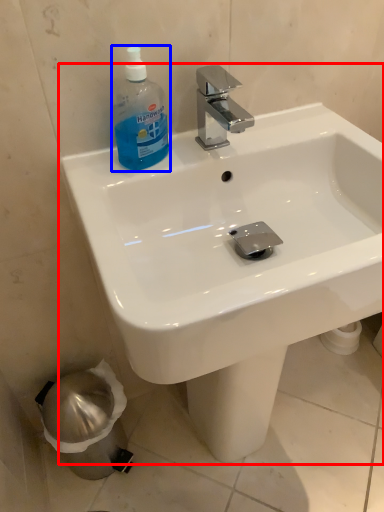
Question: Which object appears closest to the camera in this image, sink (highlighted by a red box) or cleaning product (highlighted by a blue box)?

Choices:
 (A) sink
 (B) cleaning product

Answer: (A)